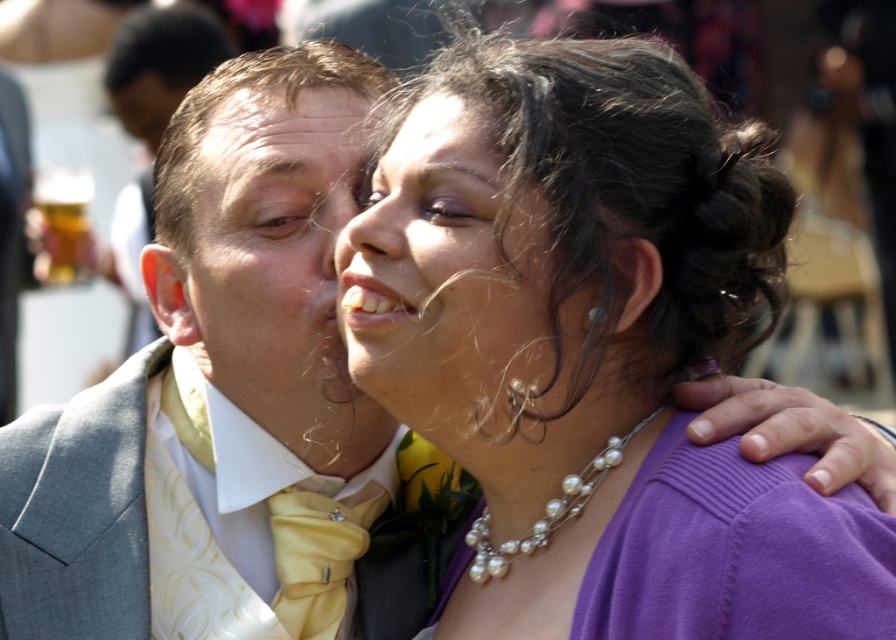
You are at a formal event and see the purple fabric at center and the matte gray suit at left. Which one is positioned to the right of the other?

The purple fabric at center is positioned to the right of the matte gray suit at left.

You are a photographer taking a portrait of the person wearing the matte yellow bow tie at left. To ensure the bow tie is centered in the photo, where should you position the camera? Please provide the coordinates as a point in the format of a tuple like this example format of a tuple like this example format of a tuple like this example format of a tuple like this example format of a tuple like this example format of a tuple like this example format of a tuple like this example format of a tuple like this.

The matte yellow bow tie at left is located at coordinates point (271,257), so to center it, the camera should be positioned at point (271,257).

You are organizing a photoshoot and need to arrange the purple fabric at center and the matte gray suit at left side by side. Based on their sizes, which one should be placed on the left to ensure they fit within the frame without overlapping?

The purple fabric at center is narrower than the matte gray suit at left, so placing the purple fabric at center on the left would allow both to fit side by side without overlapping.